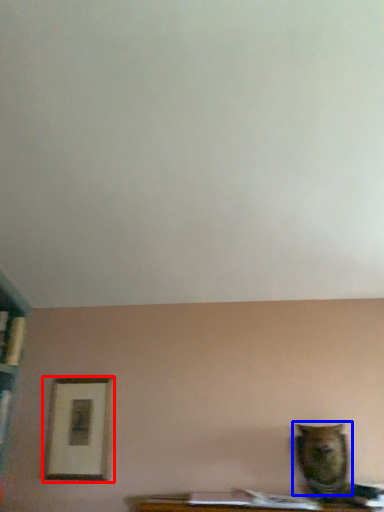
Question: Among these objects, which one is farthest to the camera, picture frame (highlighted by a red box) or animal (highlighted by a blue box)?

Choices:
 (A) picture frame
 (B) animal

Answer: (A)